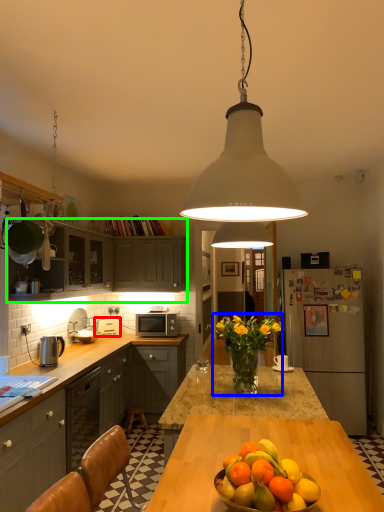
Question: Considering the real-world distances, which object is closest to appliance (highlighted by a red box)? floral arrangement (highlighted by a blue box) or cabinetry (highlighted by a green box).

Choices:
 (A) floral arrangement
 (B) cabinetry

Answer: (B)